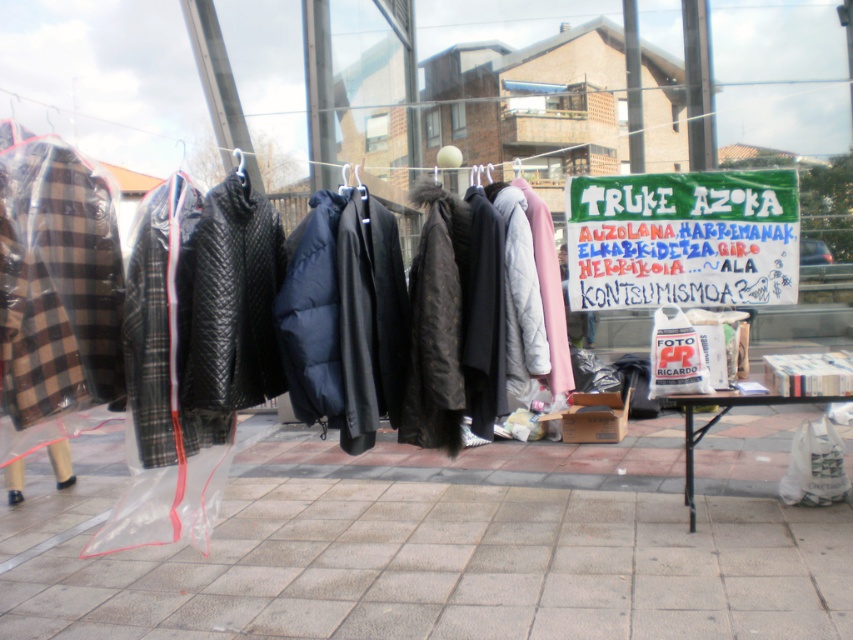
You are standing in front of the clothesline and want to walk to the green fabric sign at upper center. Which direction should you move relative to the gray concrete pavement at lower center?

To reach the green fabric sign at upper center, you should move to the right of the gray concrete pavement at lower center since the green fabric sign at upper center is located to the right of it according to the description.